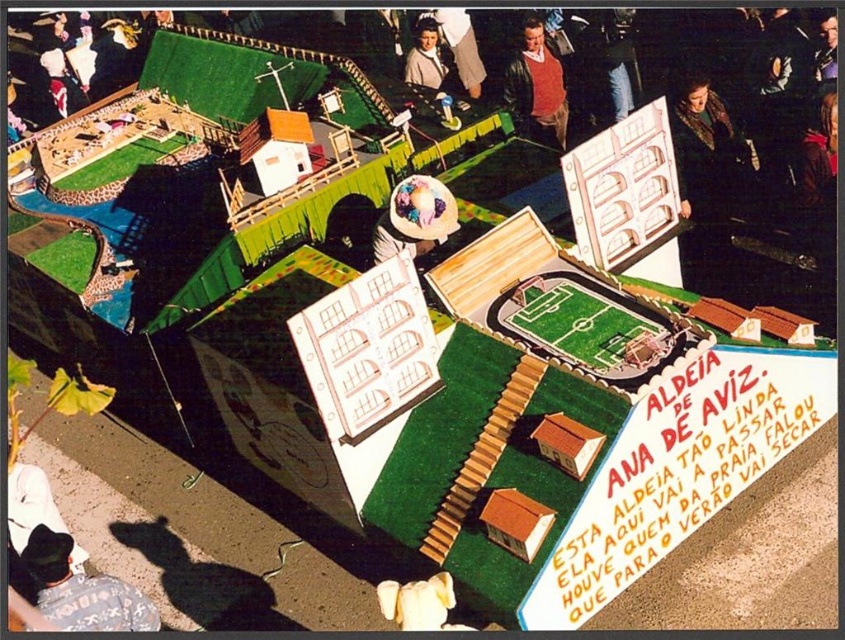
Question: Which object is the farthest from the white straw hat at center?

Choices:
 (A) white cardboard sign at center
 (B) black cotton shirt at lower left
 (C) white paper sign at lower right

Answer: (B)

Question: Can you confirm if leather jacket at upper center is positioned below matte white hat at upper center?

Choices:
 (A) no
 (B) yes

Answer: (B)

Question: Can you confirm if white straw hat at center is wider than matte brown leather jacket at upper center?

Choices:
 (A) no
 (B) yes

Answer: (B)

Question: In this image, where is dark brown leather coat at upper right located relative to white straw hat at center?

Choices:
 (A) left
 (B) right

Answer: (B)

Question: Based on their relative distances, which object is nearer to the matte brown leather jacket at upper center?

Choices:
 (A) white paper sign at lower right
 (B) leather jacket at upper center

Answer: (B)

Question: Which point appears farthest from the camera in this image?

Choices:
 (A) (415, 205)
 (B) (444, 74)
 (C) (723, 113)

Answer: (B)